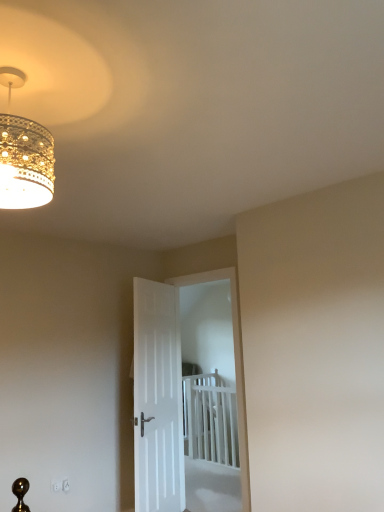
Question: Is white matte door at center, placed as the first door when sorted from right to left, in front of or behind white smooth door at center, marked as the second door in a right-to-left arrangement, in the image?

Choices:
 (A) front
 (B) behind

Answer: (B)

Question: Based on their positions, is white matte door at center, placed as the first door when sorted from right to left, located to the left or right of white smooth door at center, marked as the second door in a right-to-left arrangement?

Choices:
 (A) right
 (B) left

Answer: (A)

Question: Which object is the closest to the gold textured chandelier at upper left?

Choices:
 (A) white plastic bed at center
 (B) white matte door at center, placed as the first door when sorted from right to left
 (C) white smooth door at center, marked as the 1th door in a left-to-right arrangement

Answer: (C)

Question: Which object is positioned farthest from the white plastic bed at center?

Choices:
 (A) gold textured chandelier at upper left
 (B) white smooth door at center, marked as the second door in a right-to-left arrangement
 (C) white matte door at center, which appears as the 2th door when viewed from the left

Answer: (A)